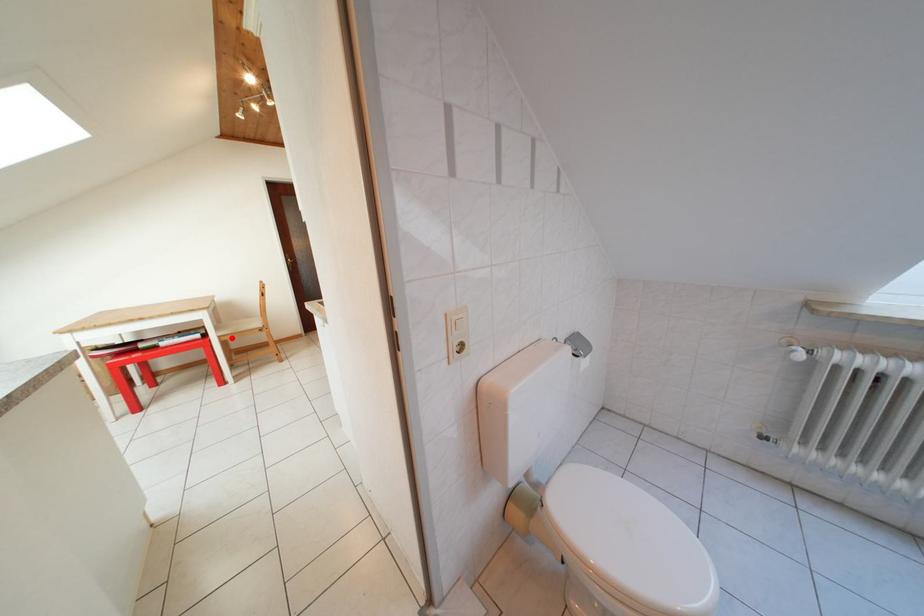
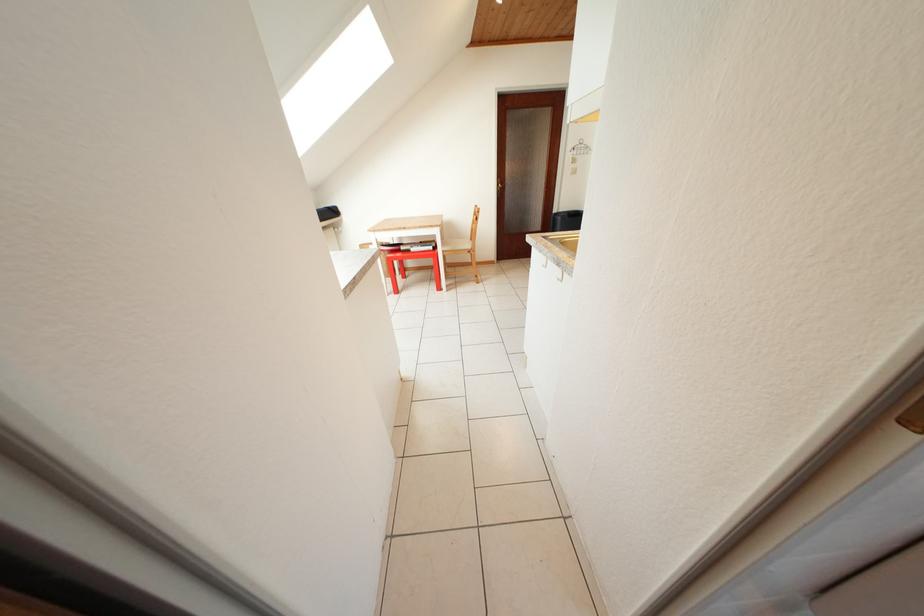
Question: I am providing you with two images of the same scene from different viewpoints. Image1 has a red point marked. In image2, the corresponding 3D location appears at what relative position? Reply with the corresponding letter.

Choices:
 (A) Closer
 (B) Farther

Answer: (A)